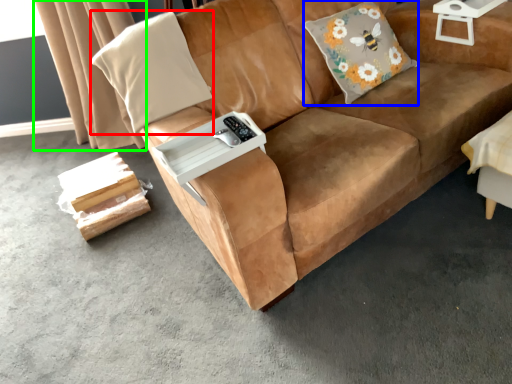
Question: Estimate the real-world distances between objects in this image. Which object is farther from throw pillow (highlighted by a red box), throw pillow (highlighted by a blue box) or curtain (highlighted by a green box)?

Choices:
 (A) throw pillow
 (B) curtain

Answer: (B)